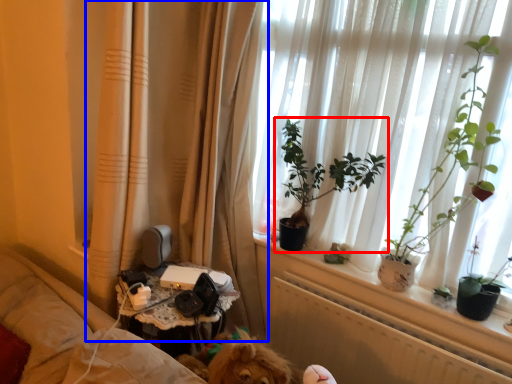
Question: Which object is closer to the camera taking this photo, houseplant (highlighted by a red box) or curtain (highlighted by a blue box)?

Choices:
 (A) houseplant
 (B) curtain

Answer: (B)